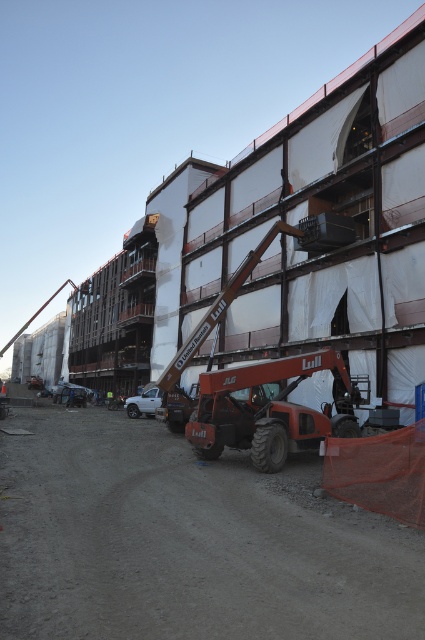
You are a delivery driver approaching the construction site and need to navigate through the dirt track at center and the orange metallic trailer truck at center. Which path should you choose to ensure your vehicle can pass safely?

The dirt track at center is taller than the orange metallic trailer truck at center, so you should choose the dirt track at center to ensure your vehicle can pass safely.